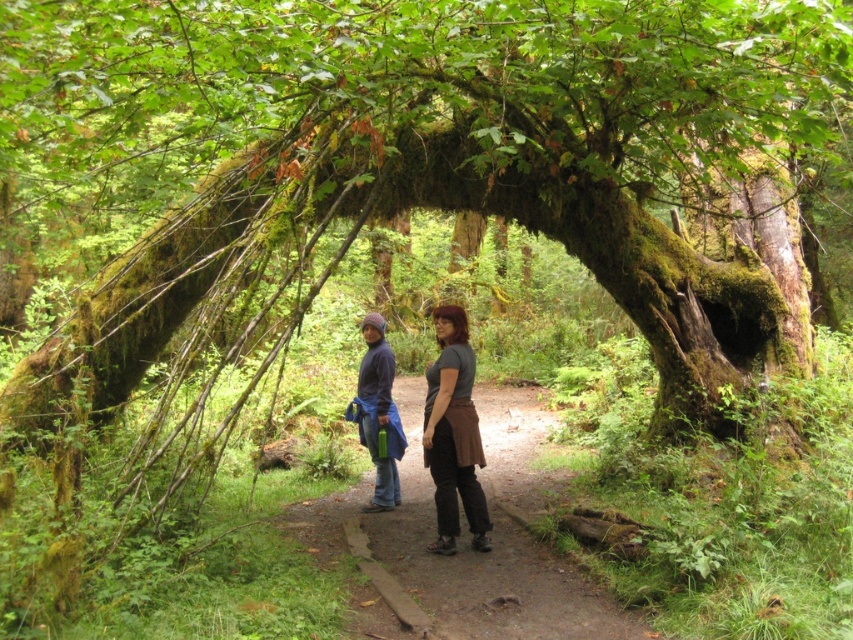
You are hiking in the forest and see the dirt path at center and the brushed metal jacket at center. Which object is closer to the ground?

The dirt path at center is located below the brushed metal jacket at center, so the dirt path at center is closer to the ground.